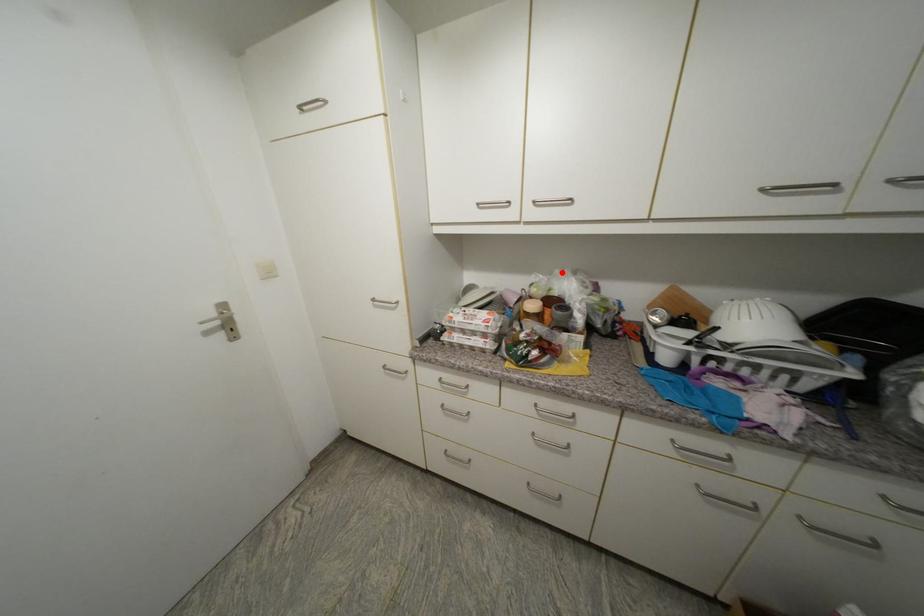
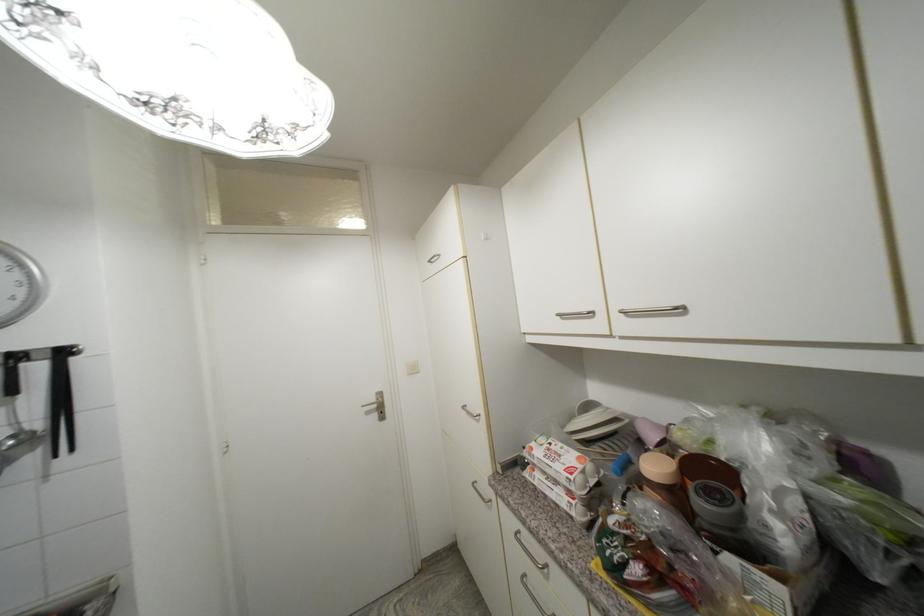
Locate, in the second image, the point that corresponds to the highlighted location in the first image.

(730, 410)